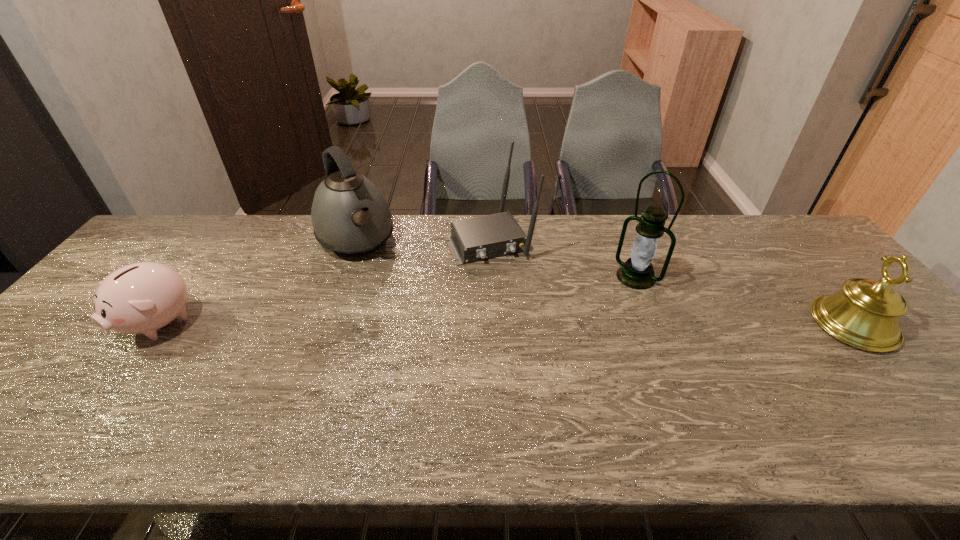
The height and width of the screenshot is (540, 960). I want to click on vacant spot on the desktop that is between the shortest object and the fourth tallest object and is positioned on the side where the lantern emits light, so click(588, 324).

This screenshot has width=960, height=540. Identify the location of vacant space on the desktop that is between the piggy bank and the bell and is positioned on the back of the router to connect cables. (537, 324).

At what (x,y) coordinates should I click in order to perform the action: click on vacant space on the desktop that is between the shortest object and the second shortest object and is positioned at the spout of the fourth object from right to left. Please return your answer as a coordinate pair (x, y). This screenshot has width=960, height=540. Looking at the image, I should click on (406, 323).